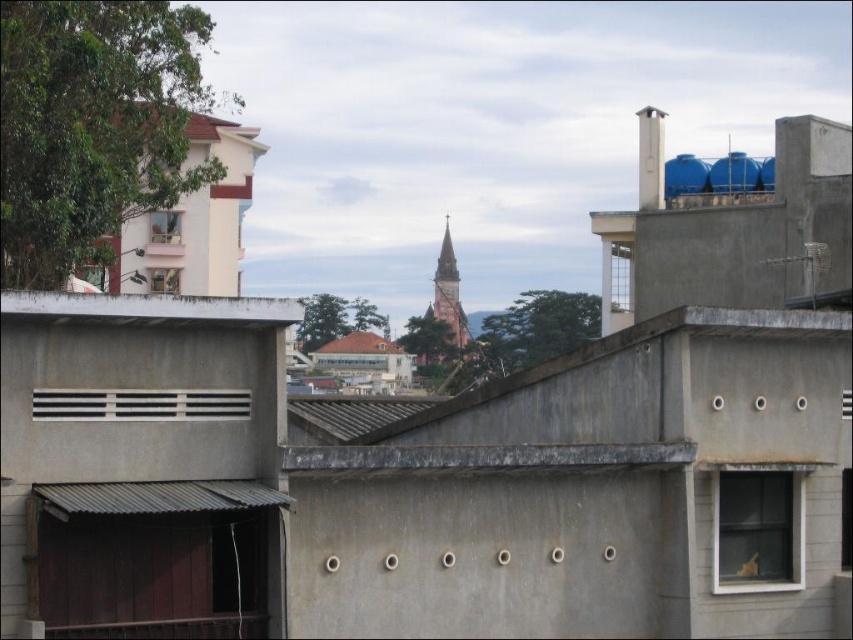
You are an architect reviewing the rooftop layout. You need to determine which window is higher up between the matte white window at upper left and the clear glass window at upper left. Based on the rooftop view, which one is located higher?

The matte white window at upper left is positioned over the clear glass window at upper left, so it is higher up.

You are an architect designing a new building and want to ensure proper spacing between the matte white window at upper left and the clear glass window at upper left. Given their widths, which window requires more horizontal space for installation?

The clear glass window at upper left requires more horizontal space for installation since its width is greater than the matte white window at upper left.

You are standing on the rooftop and want to take a photo of both the transparent glass window at lower right and the brown tiled roof at center. Given that your camera has a maximum zoom range of 100 meters, will you be able to capture both objects in a single frame without moving your position?

The transparent glass window at lower right is 151.82 meters away from the brown tiled roof at center. Since the distance exceeds the camera maximum zoom range of 100 meters, you won wait be able to capture both objects in a single frame without moving your position.